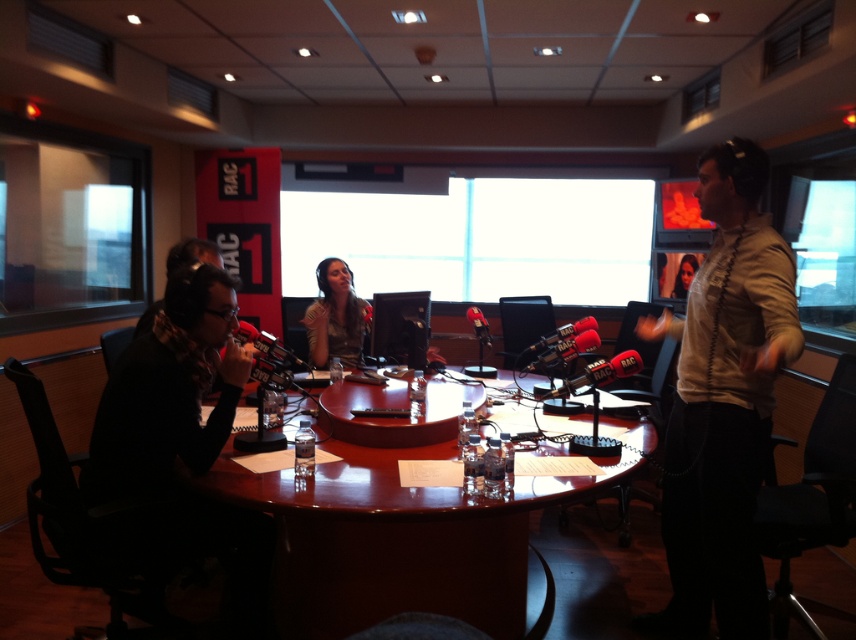
In the radio studio scene, there are two people wearing shirts. One is wearing a light beige shirt at right and the other a striped fabric shirt at center. Which shirt is bigger?

The light beige shirt at right is larger in size than the striped fabric shirt at center.

Looking at the striped fabric shirt at center and the matte black hair at center, which one is bigger in size?

The striped fabric shirt at center is larger in size compared to the matte black hair at center.

You are a technician in the radio studio and need to adjust the microphone stand between the striped fabric shirt at center and the matte black hair at center. The stand requires a minimum of 3 meters of space to be safely moved. Is there enough space between them?

The distance between the striped fabric shirt at center and the matte black hair at center is 2.83 meters, which is less than the required 3 meters. Therefore, there isn not enough space to safely move the microphone stand between them.